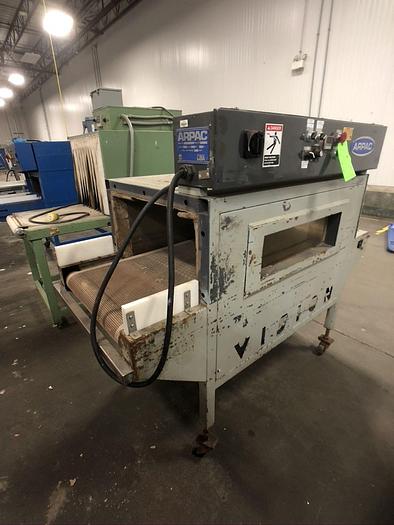
You are a GUI agent. You are given a task and a screenshot of the screen. Output one action in this format:
    pyautogui.click(x=<x>, y=<y>)
    Task: Click on the black cord
    The width and height of the screenshot is (394, 525).
    Given the screenshot: What is the action you would take?
    pyautogui.click(x=171, y=279), pyautogui.click(x=80, y=217)